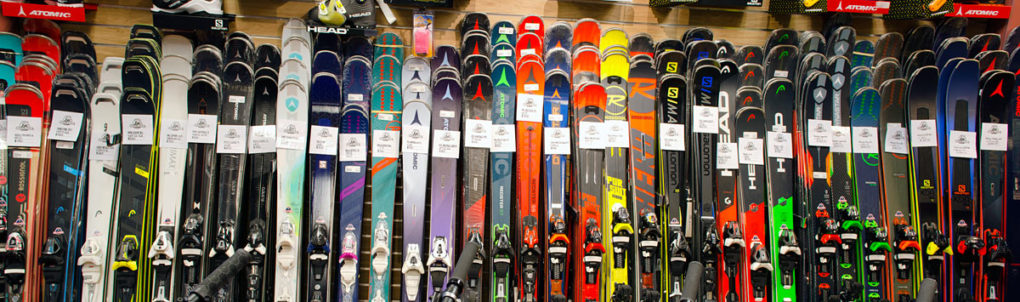
This screenshot has width=1020, height=302. What are the coordinates of `shoe stand display` in the screenshot? It's located at (967, 8), (875, 5), (724, 4), (324, 33), (170, 19), (51, 9).